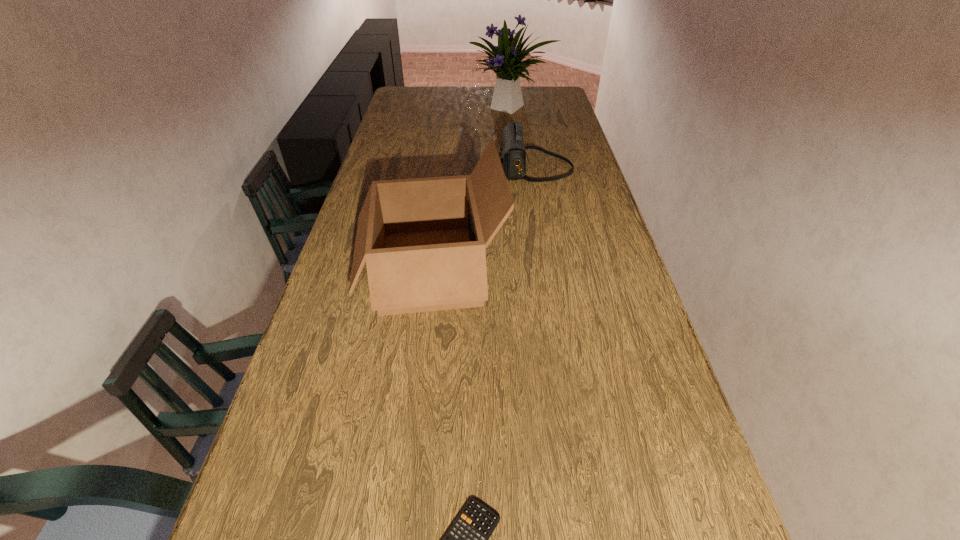
Locate an element on the screen. The width and height of the screenshot is (960, 540). free spot that satisfies the following two spatial constraints: 1. on the back side of the flower arrangement; 2. on the right side of the third farthest object is located at coordinates (450, 108).